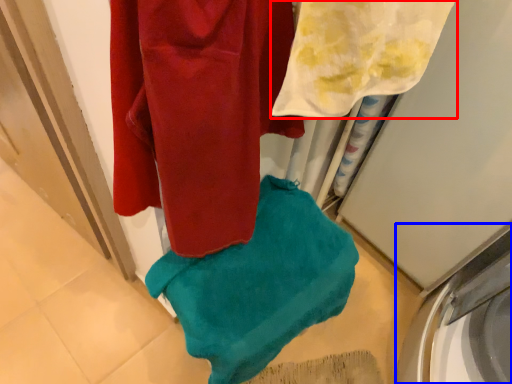
Question: Which point is further to the camera, towel (highlighted by a red box) or washing machine (highlighted by a blue box)?

Choices:
 (A) towel
 (B) washing machine

Answer: (B)